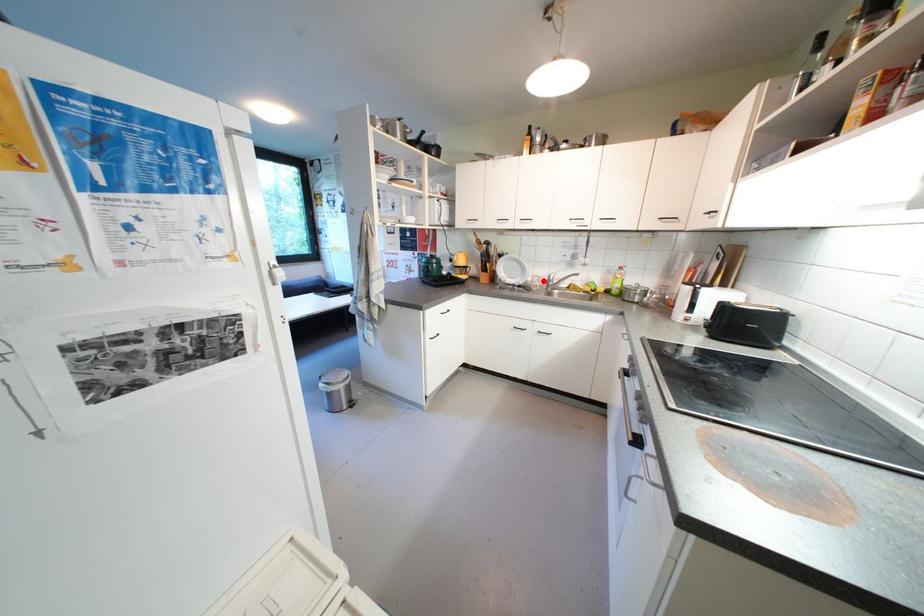
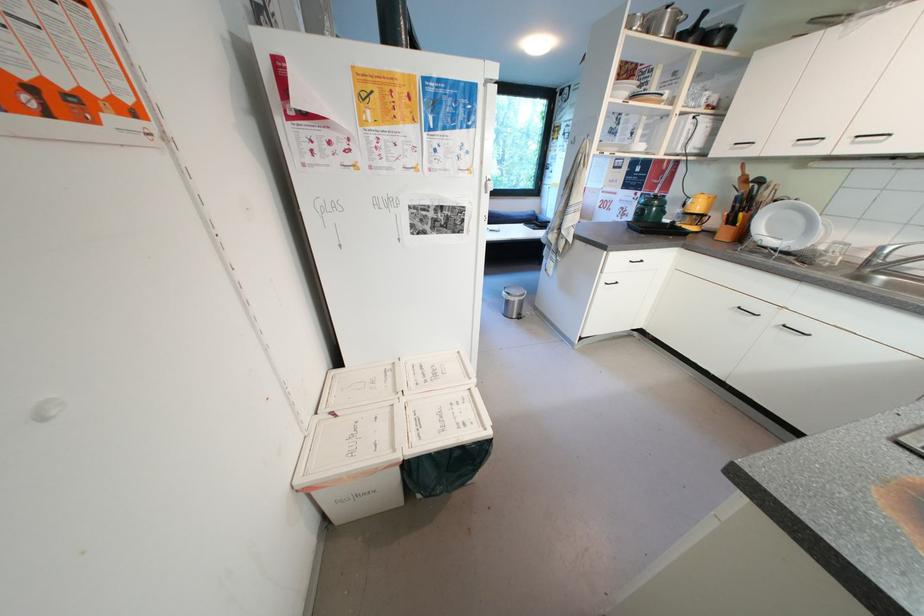
Question: I am providing you with two images of the same scene from different viewpoints. A red point is marked on the first image. Is the red point's position out of view in image 2?

Choices:
 (A) Yes
 (B) No

Answer: (B)